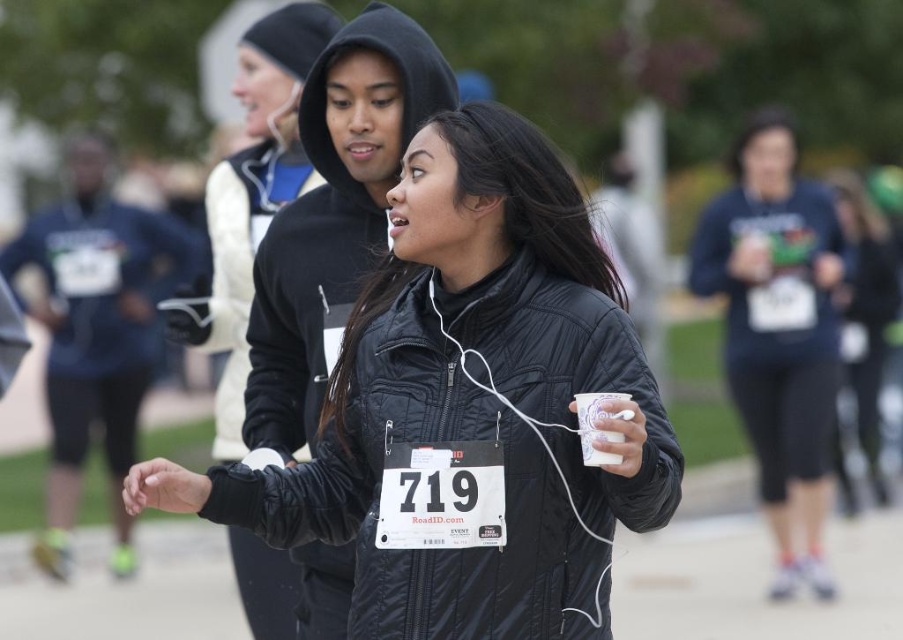
Find the location of `matte blue sweatshirt at center`. matte blue sweatshirt at center is located at coordinates (778, 330).

Which is more to the right, matte blue sweatshirt at center or white paper cup at center?

Positioned to the right is matte blue sweatshirt at center.

Does point (711, 259) lie in front of point (598, 401)?

No, (711, 259) is behind (598, 401).

Where is `matte blue sweatshirt at center`? matte blue sweatshirt at center is located at coordinates pyautogui.click(x=778, y=330).

Is black quilted jacket at center thinner than white paper cup at center?

Incorrect, black quilted jacket at center's width is not less than white paper cup at center's.

How distant is black quilted jacket at center from white paper cup at center?

black quilted jacket at center is 15.48 inches from white paper cup at center.

Describe the element at coordinates (468, 406) in the screenshot. This screenshot has width=903, height=640. I see `black quilted jacket at center` at that location.

Where is `black quilted jacket at center`? The image size is (903, 640). black quilted jacket at center is located at coordinates (468, 406).

Is black quilted jacket at center bigger than matte blue sweatshirt at center?

Actually, black quilted jacket at center might be smaller than matte blue sweatshirt at center.

Can you confirm if black quilted jacket at center is positioned above matte blue sweatshirt at center?

Yes, black quilted jacket at center is above matte blue sweatshirt at center.

Is point (427, 624) behind point (725, 364)?

No, it is not.

Locate an element on the screen. black quilted jacket at center is located at coordinates (468, 406).